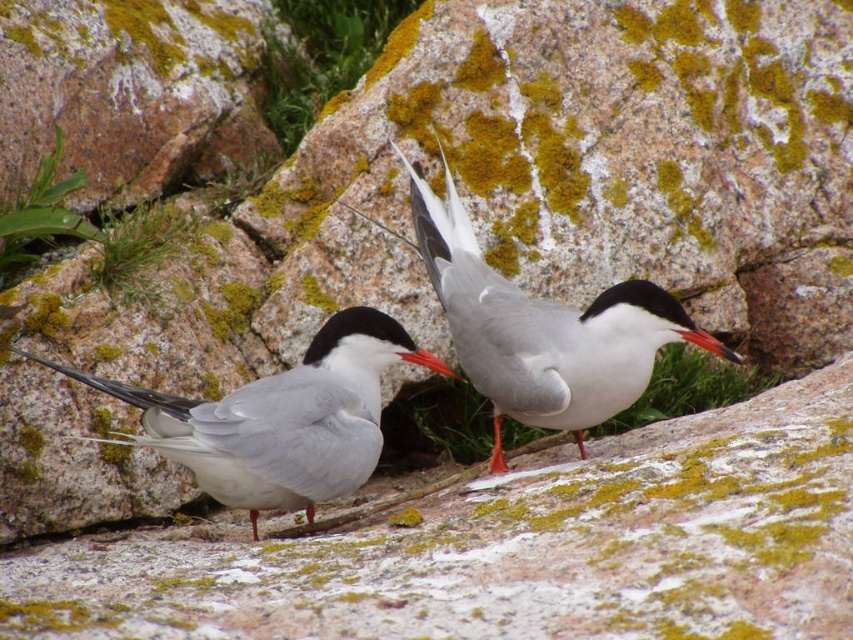
Question: Which point is closer to the camera?

Choices:
 (A) white glossy tern at center
 (B) orange glossy beak at center

Answer: (A)

Question: Does white glossy bird at center appear under white glossy tern at center?

Choices:
 (A) no
 (B) yes

Answer: (A)

Question: Which point is farther from the camera taking this photo?

Choices:
 (A) (410, 355)
 (B) (445, 182)
 (C) (71, 374)
 (D) (689, 332)

Answer: (B)

Question: Estimate the real-world distances between objects in this image. Which object is closer to the smooth glossy beak at center?

Choices:
 (A) orange glossy beak at center
 (B) white glossy tern at center

Answer: (A)

Question: Can you confirm if white glossy bird at center is positioned below white glossy tern at center?

Choices:
 (A) no
 (B) yes

Answer: (A)

Question: Observing the image, what is the correct spatial positioning of white glossy bird at center in reference to smooth glossy beak at center?

Choices:
 (A) above
 (B) below

Answer: (A)